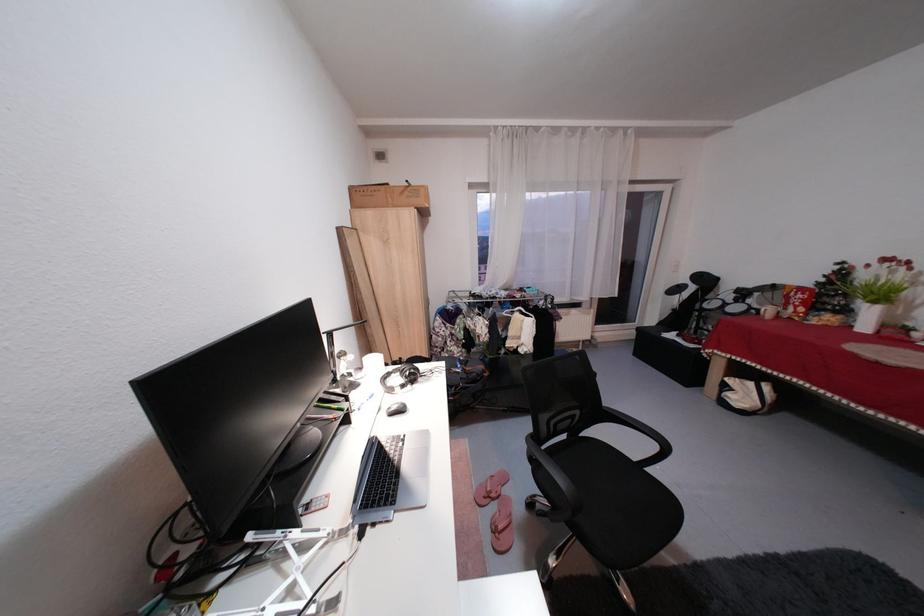
The image size is (924, 616). What do you see at coordinates (399, 377) in the screenshot? I see `a silver headphones` at bounding box center [399, 377].